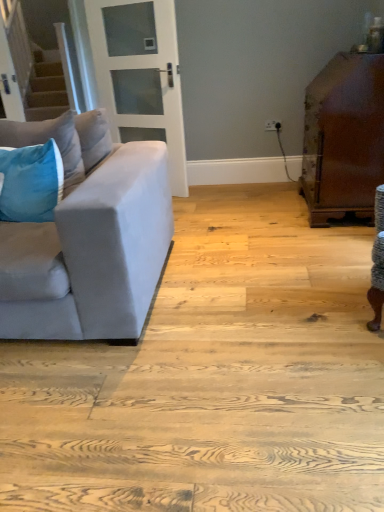
The height and width of the screenshot is (512, 384). In order to click on vacant space that's between glossy brown wooden cabinet at right and white glass door at upper center in this screenshot , I will do `click(248, 202)`.